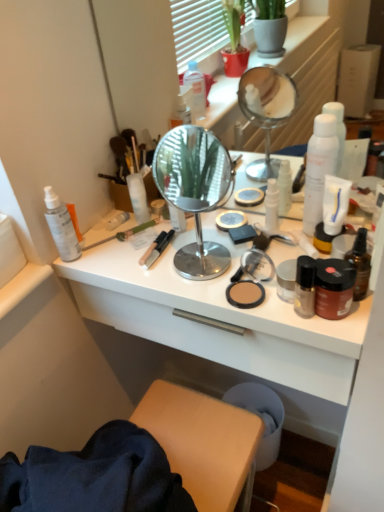
Find the location of a particular element. free region on the left part of polished chrome mirror at center is located at coordinates coord(130,261).